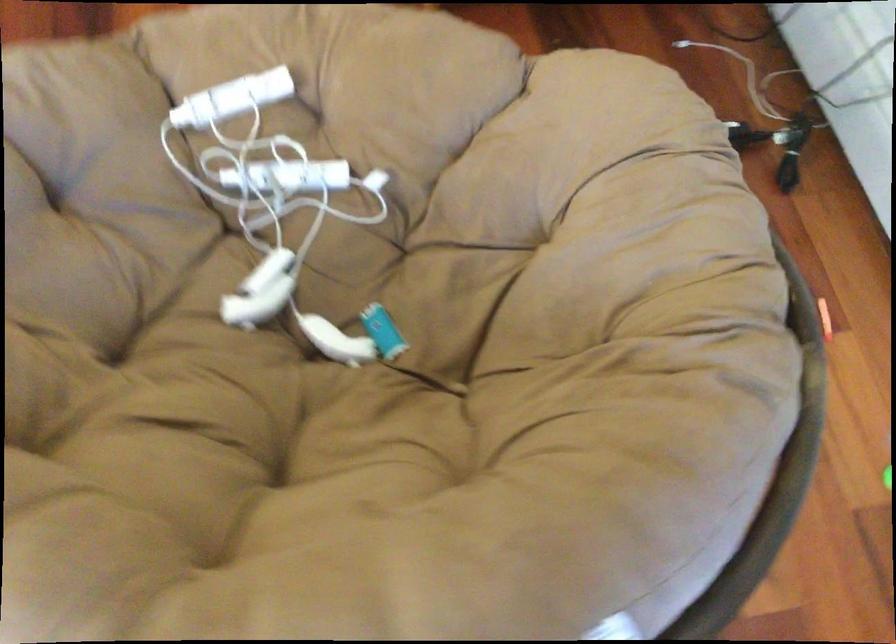
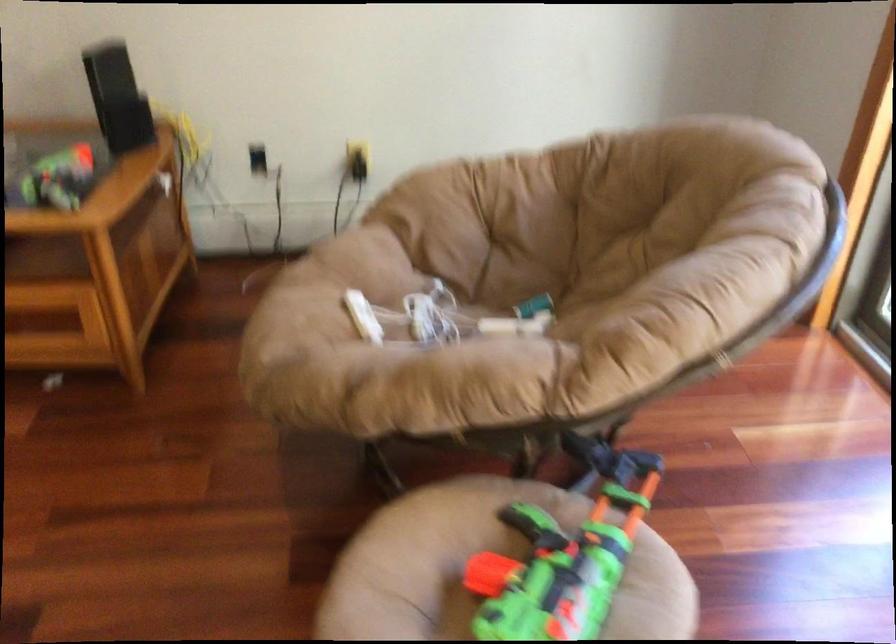
Locate, in the second image, the point that corresponds to pixel 289 201 in the first image.

(442, 317)